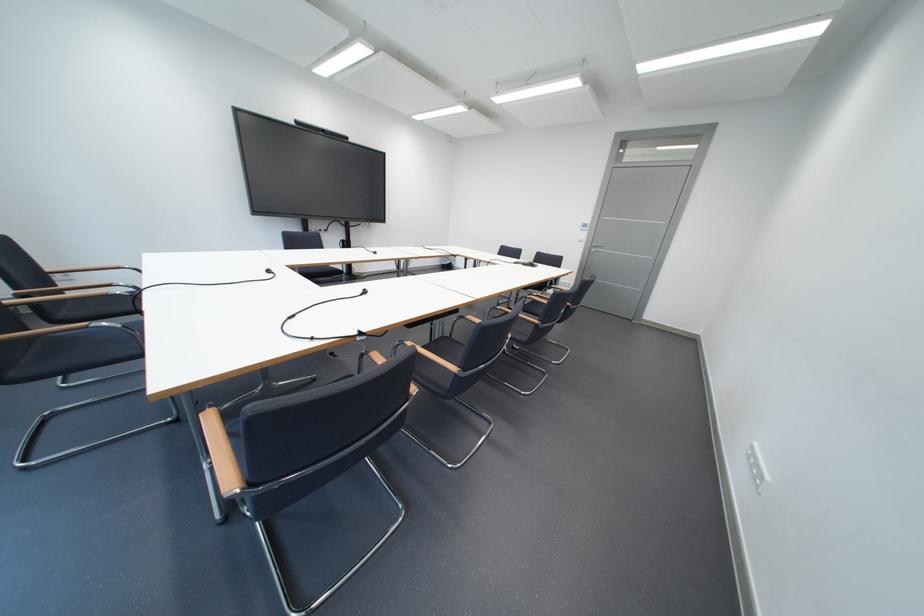
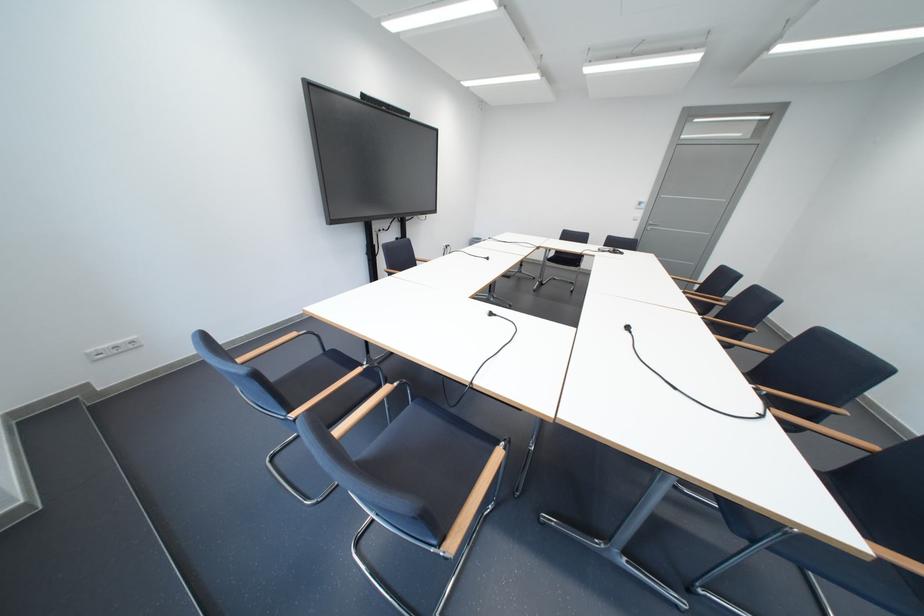
Locate, in the second image, the point that corresponds to pixel 603 248 in the first image.

(660, 227)